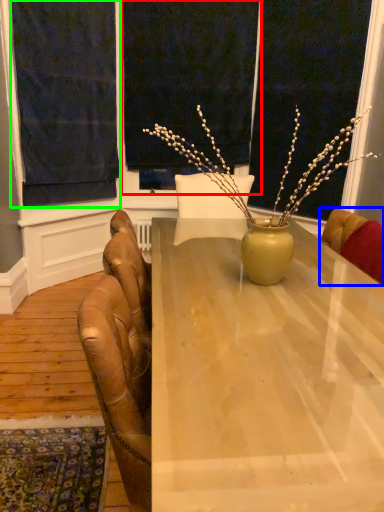
Question: Which object is the farthest from window screen (highlighted by a red box)? Choose among these: chair (highlighted by a blue box) or curtain (highlighted by a green box).

Choices:
 (A) chair
 (B) curtain

Answer: (A)